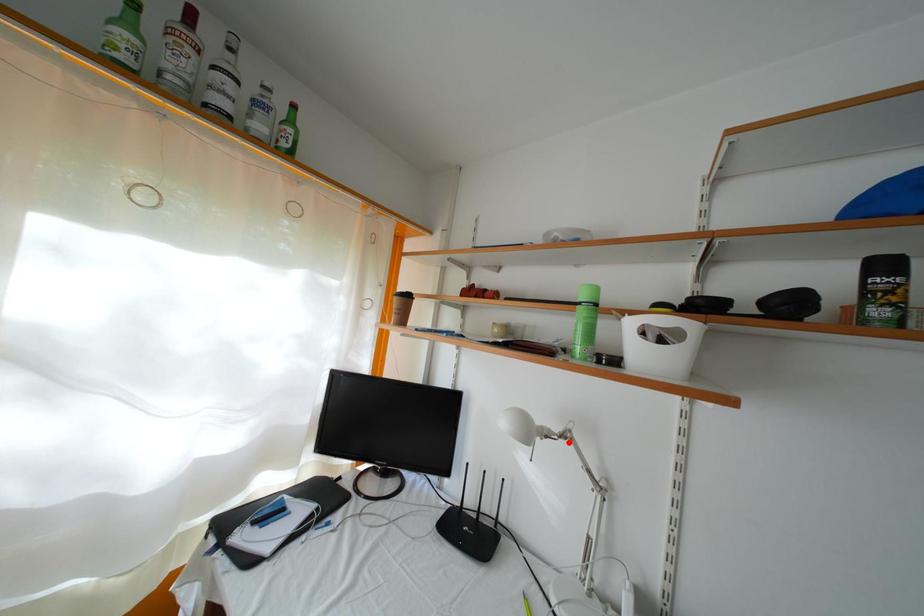
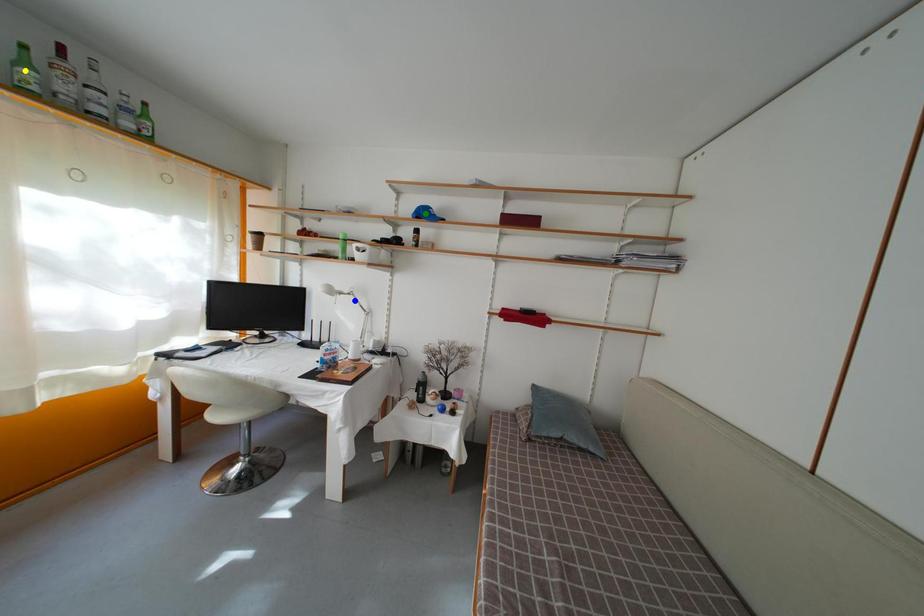
Question: I am providing you with two images of the same scene from different viewpoints. A red point is marked on the first image. You are given multiple points on the second image. In image 2, which mark is for the same physical point as the one in image 1?

Choices:
 (A) yellow point
 (B) blue point
 (C) green point

Answer: (B)